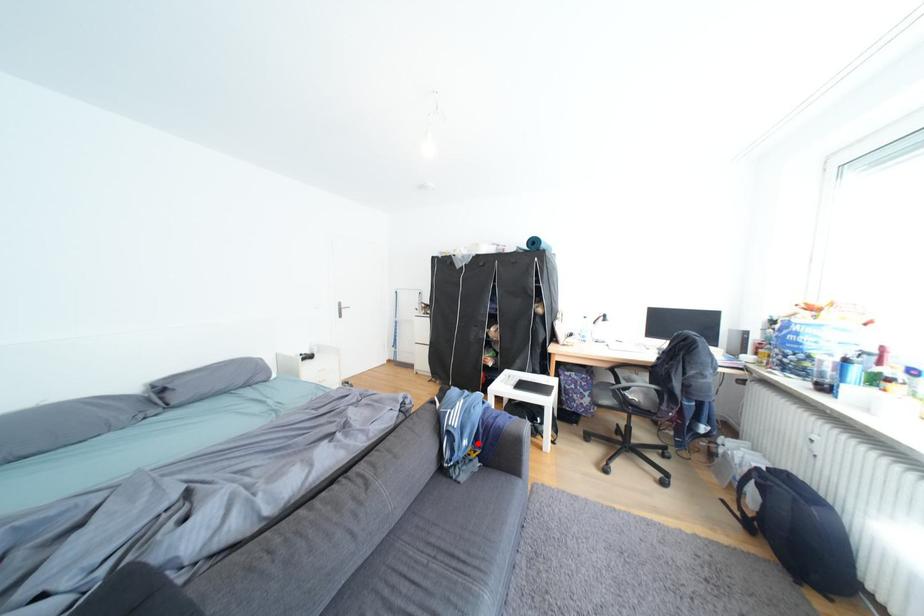
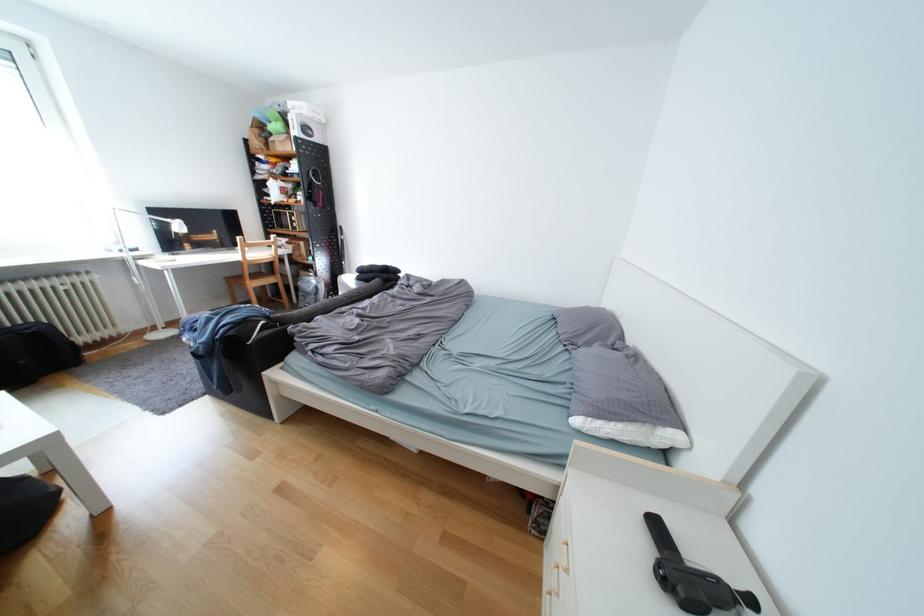
Question: I am providing you with two images of the same scene from different viewpoints. A red point is marked on the first image. Is the red point's position out of view in image 2?

Choices:
 (A) Yes
 (B) No

Answer: (A)